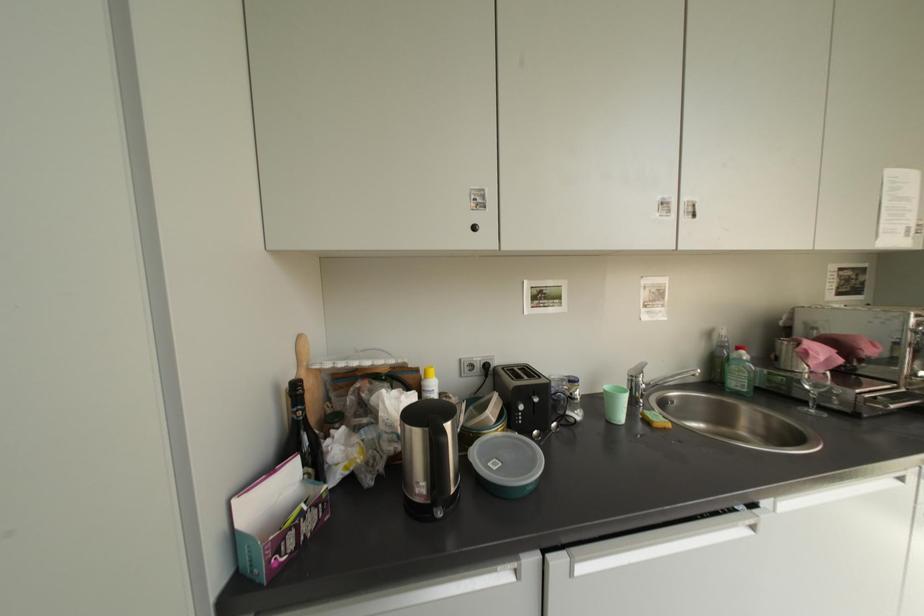
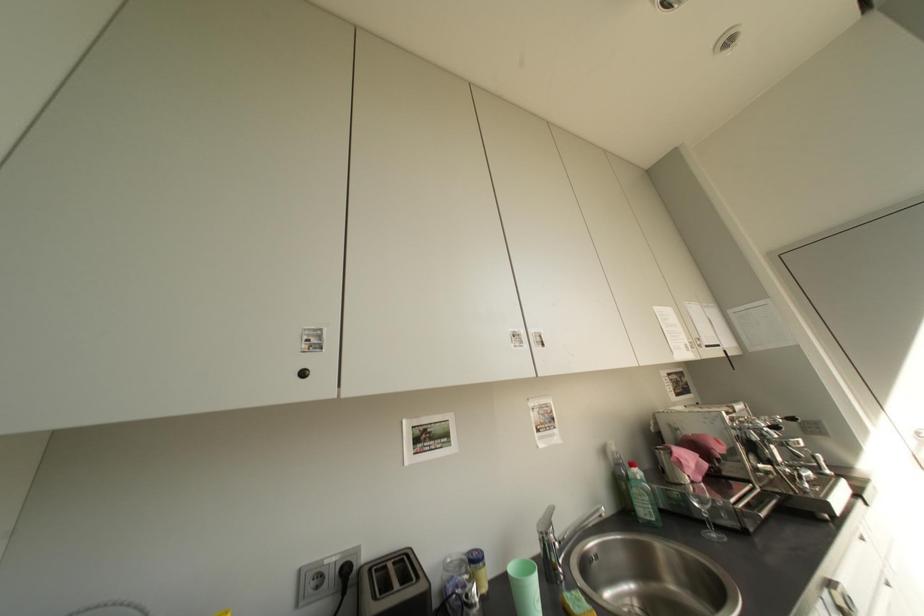
The first image is from the beginning of the video and the second image is from the end. How did the camera likely rotate when shooting the video?

The camera's rotation is toward right-up.